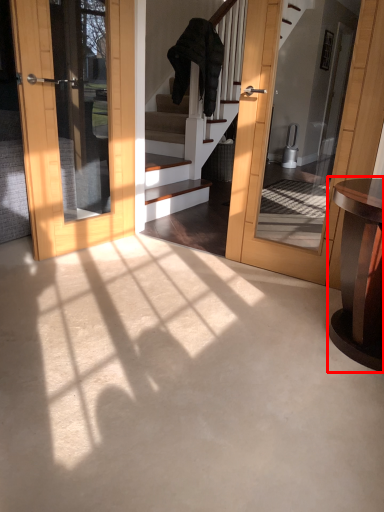
Question: From the image's perspective, where is table (annotated by the red box) located in relation to robe in the image?

Choices:
 (A) below
 (B) above

Answer: (A)